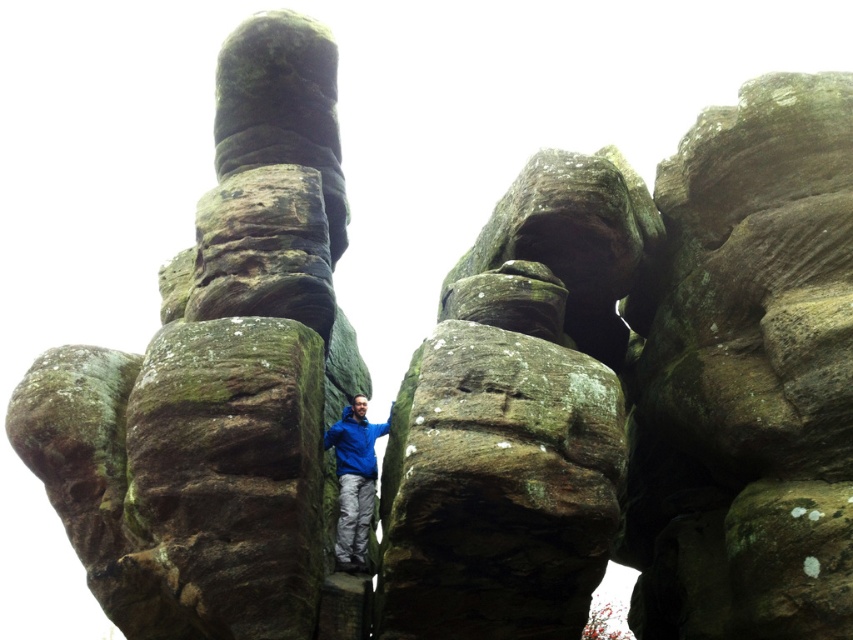
Question: Estimate the real-world distances between objects in this image. Which object is closer to the blue matte jacket at center?

Choices:
 (A) green mossy rock at center
 (B) blue fabric jacket at center

Answer: (B)

Question: Can you confirm if green mossy rock at center is bigger than blue fabric jacket at center?

Choices:
 (A) no
 (B) yes

Answer: (B)

Question: Which point is farther to the camera?

Choices:
 (A) blue fabric jacket at center
 (B) blue matte jacket at center
 (C) green mossy rock at center

Answer: (B)

Question: Can you confirm if green mossy rock at center is positioned to the right of blue fabric jacket at center?

Choices:
 (A) no
 (B) yes

Answer: (A)

Question: Which point is farther to the camera?

Choices:
 (A) (363, 433)
 (B) (334, 444)

Answer: (A)

Question: Is green mossy rock at center above blue fabric jacket at center?

Choices:
 (A) no
 (B) yes

Answer: (B)